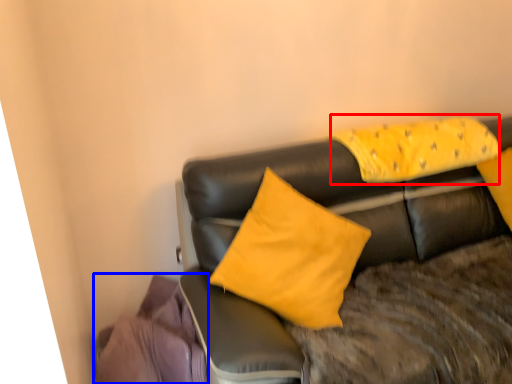
Question: Which point is closer to the camera, pillow (highlighted by a red box) or material (highlighted by a blue box)?

Choices:
 (A) pillow
 (B) material

Answer: (B)